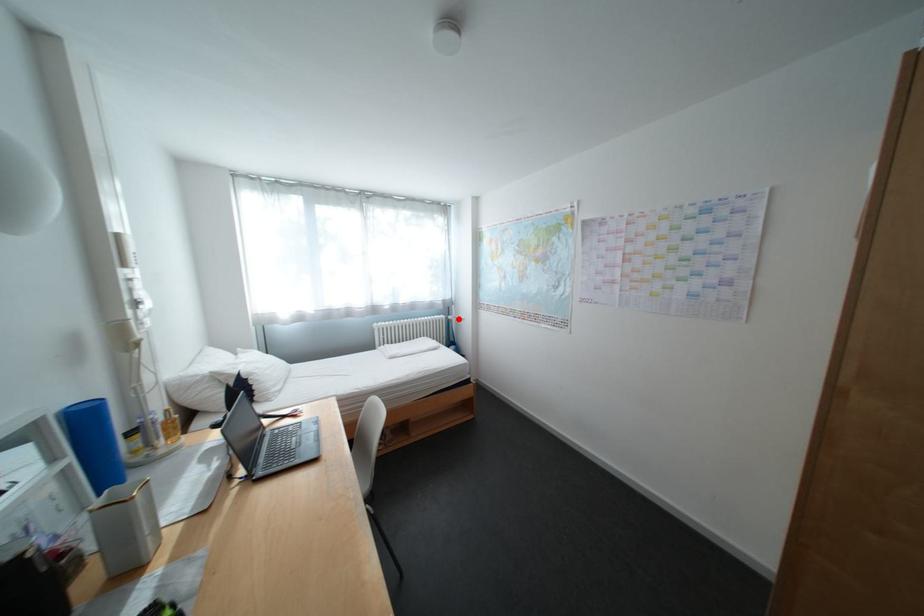
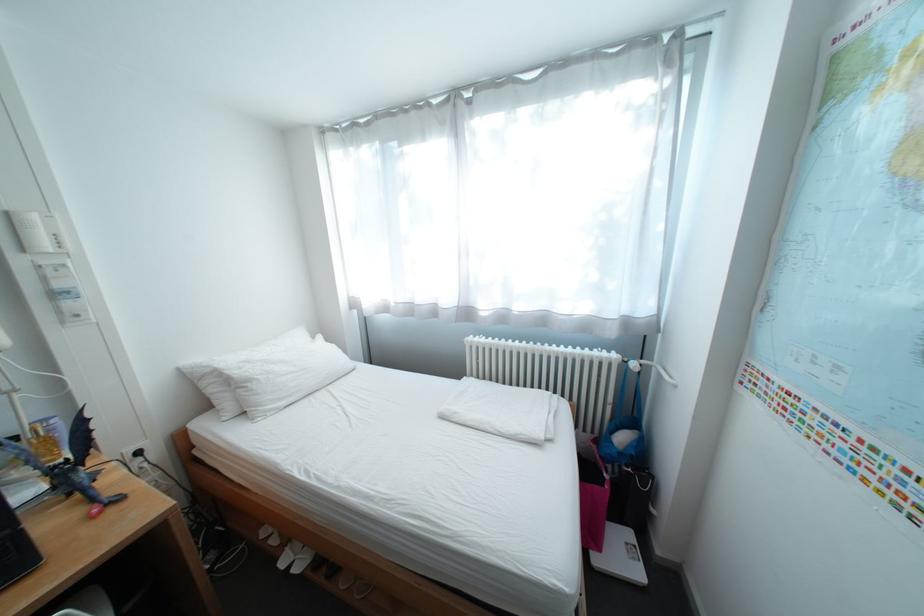
The point at the highlighted location is marked in the first image. Where is the corresponding point in the second image?

(637, 362)